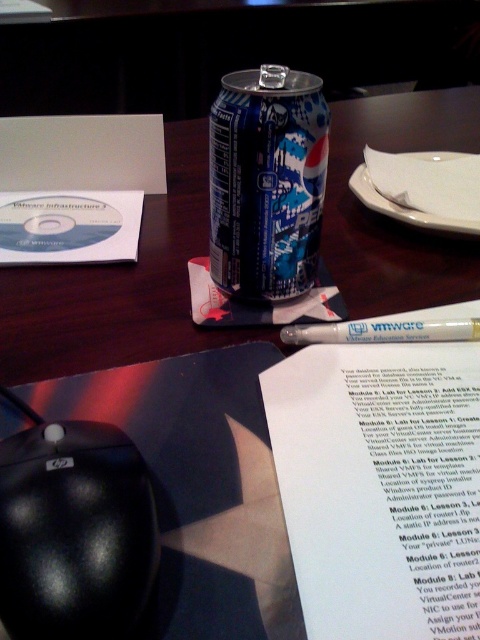
Question: Does blue metallic pepsi can at center have a smaller size compared to white matte pen at center?

Choices:
 (A) no
 (B) yes

Answer: (A)

Question: Can you confirm if blue metallic pepsi can at center is positioned to the right of white matte pen at center?

Choices:
 (A) no
 (B) yes

Answer: (A)

Question: Which object is farther from the camera taking this photo?

Choices:
 (A) blue metallic pepsi can at center
 (B) black matte mouse at lower left
 (C) white matte pen at center

Answer: (C)

Question: Which is farther from the blue metallic pepsi can at center?

Choices:
 (A) black matte mouse at lower left
 (B) white matte pen at center

Answer: (A)

Question: Which of the following is the closest to the observer?

Choices:
 (A) white matte pen at center
 (B) black matte mouse at lower left
 (C) blue metallic pepsi can at center

Answer: (B)

Question: Can you confirm if black matte mouse at lower left is wider than white matte pen at center?

Choices:
 (A) no
 (B) yes

Answer: (A)